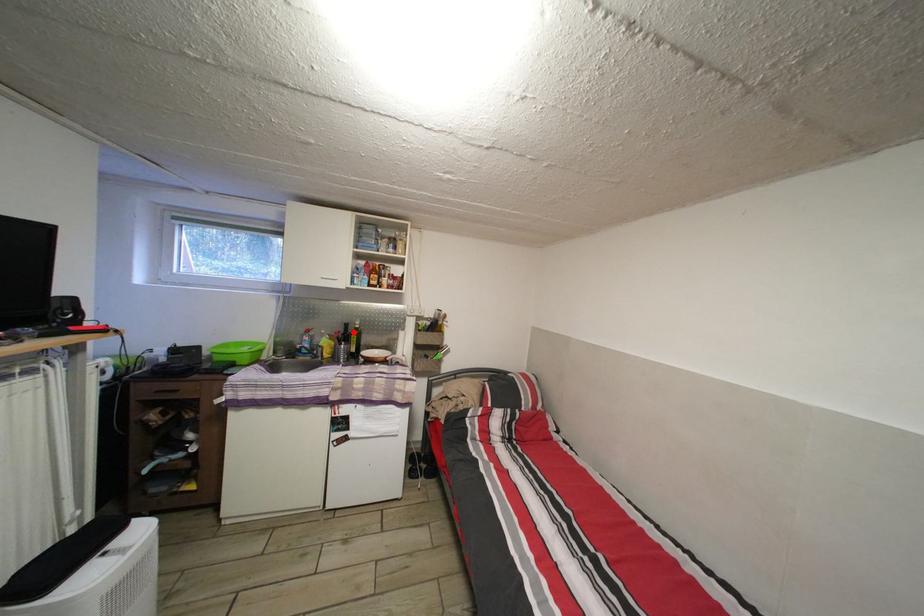
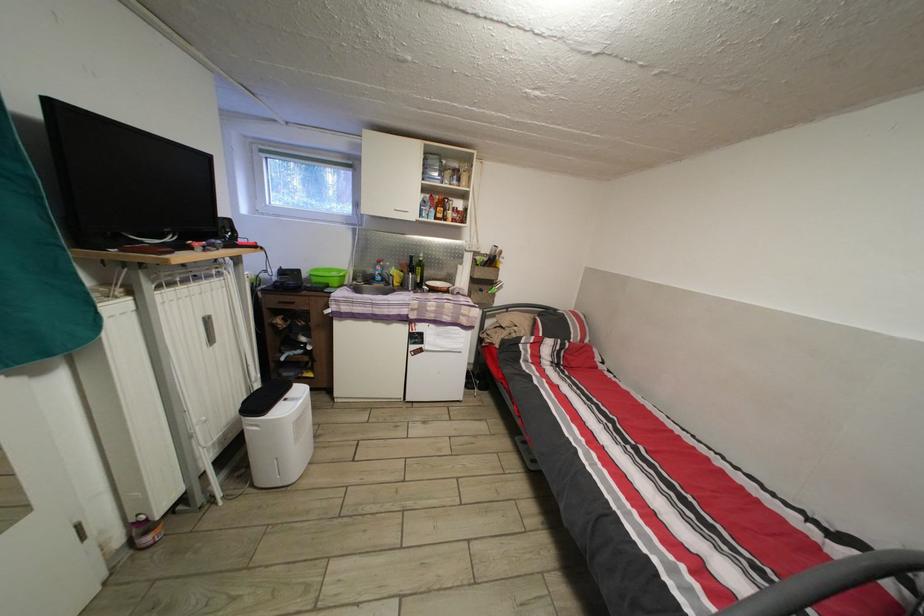
Question: I am providing you with two images of the same scene from different viewpoints. A red point is shown in image1. For the corresponding object point in image2, is it positioned nearer or farther from the camera?

Choices:
 (A) Nearer
 (B) Farther

Answer: (A)